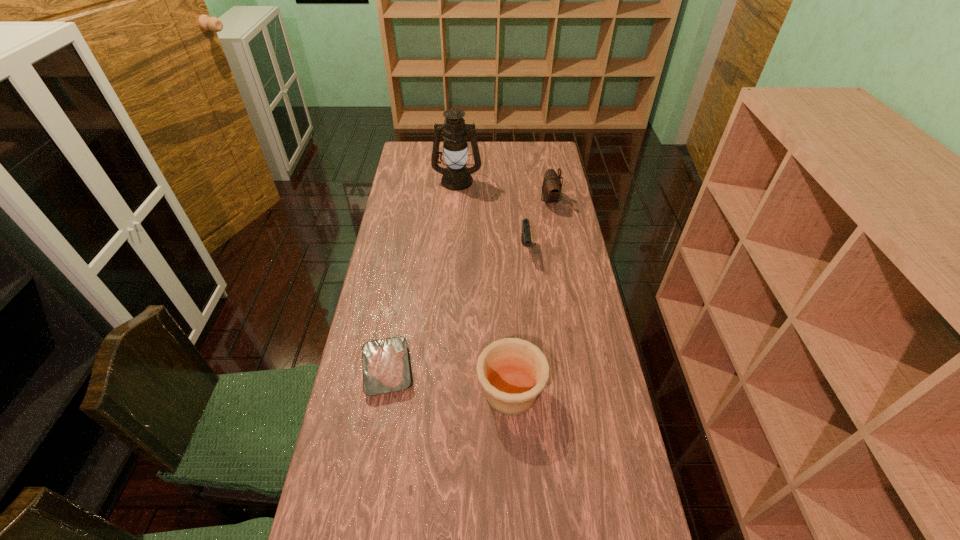
The width and height of the screenshot is (960, 540). In order to click on vacant space situated 0.050m on the right of the pottery in this screenshot , I will do `click(563, 392)`.

I want to click on vacant space located 0.320m at the barrel of the second shortest object, so click(x=534, y=331).

Locate an element on the screen. free spot located on the right of the steak is located at coordinates (448, 369).

The image size is (960, 540). I want to click on object present at the left edge, so click(386, 369).

The image size is (960, 540). What are the coordinates of `object situated at the right edge` in the screenshot? It's located at (551, 189).

Locate an element on the screen. This screenshot has width=960, height=540. vacant space at the far edge of the desktop is located at coordinates (484, 151).

This screenshot has height=540, width=960. Identify the location of free space at the left edge of the desktop. (370, 296).

Locate an element on the screen. The width and height of the screenshot is (960, 540). vacant space at the right edge of the desktop is located at coordinates (615, 396).

Find the location of `free point at the far left corner`. free point at the far left corner is located at coordinates (408, 152).

This screenshot has width=960, height=540. In the image, there is a desktop. In order to click on vacant space at the far right corner in this screenshot , I will do `click(534, 159)`.